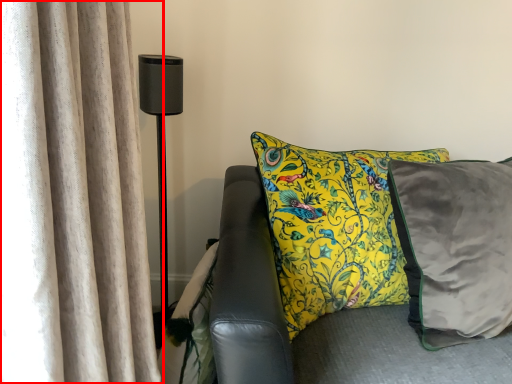
Question: From the image, what is the correct spatial relationship of curtain (annotated by the red box) in relation to table lamp?

Choices:
 (A) right
 (B) left

Answer: (A)